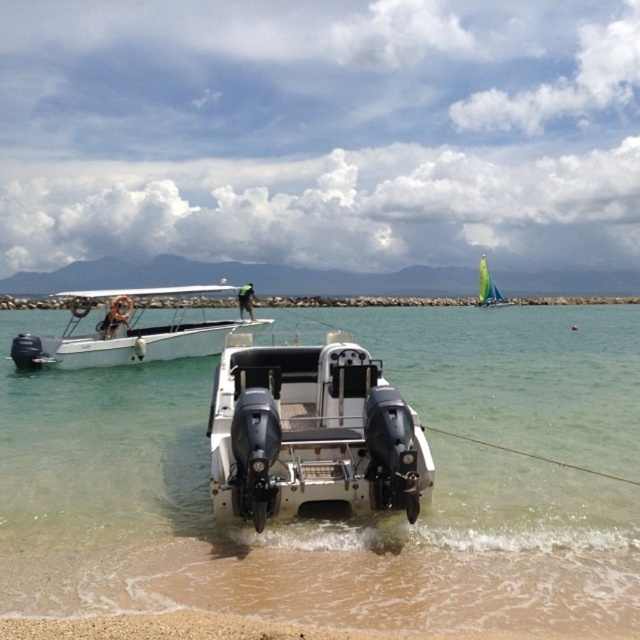
You are standing on the beach and want to walk to the boat closest to you. Which direction should you move relative to the white sand at lower center and the clear water at boat front?

You should move towards the clear water at boat front, which is in front of the white sand at lower center, to reach the boat closest to you.

You are a marine biologist examining the image of the coastal scene. You need to locate the clear water at boat front for a water sample. According to the coordinates provided, where exactly should you collect the sample?

The clear water at boat front is located at coordinates point (355, 518).